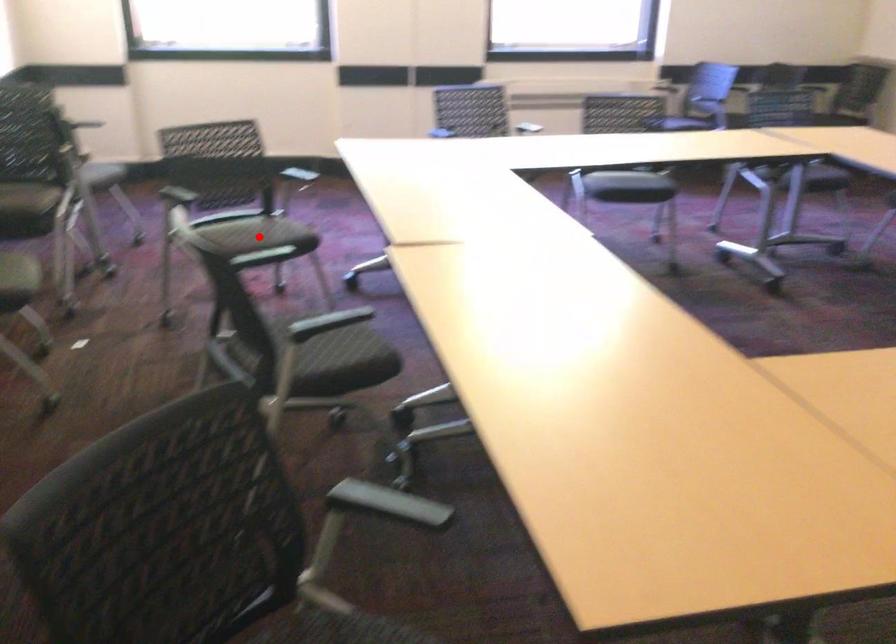
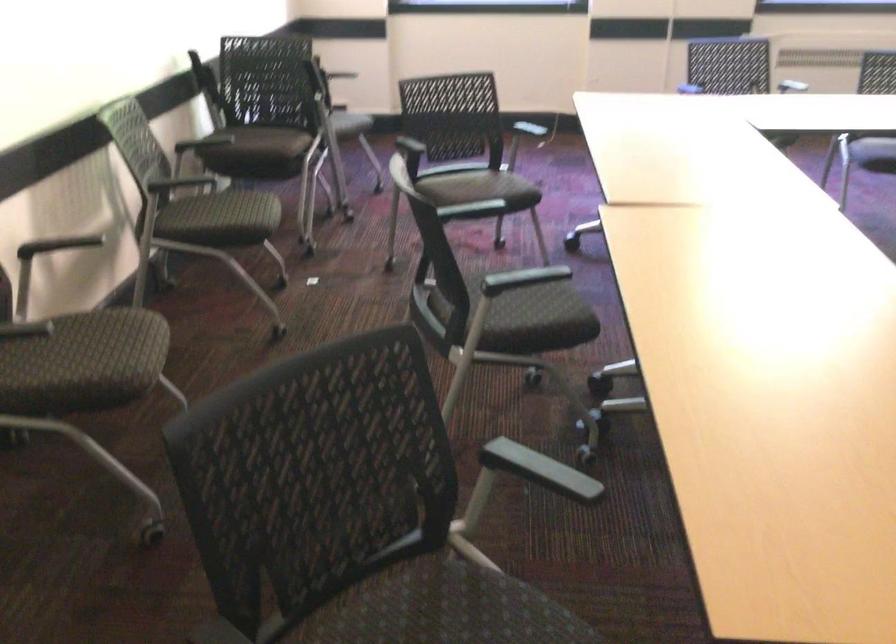
Find the pixel in the second image that matches the highlighted location in the first image.

(479, 189)